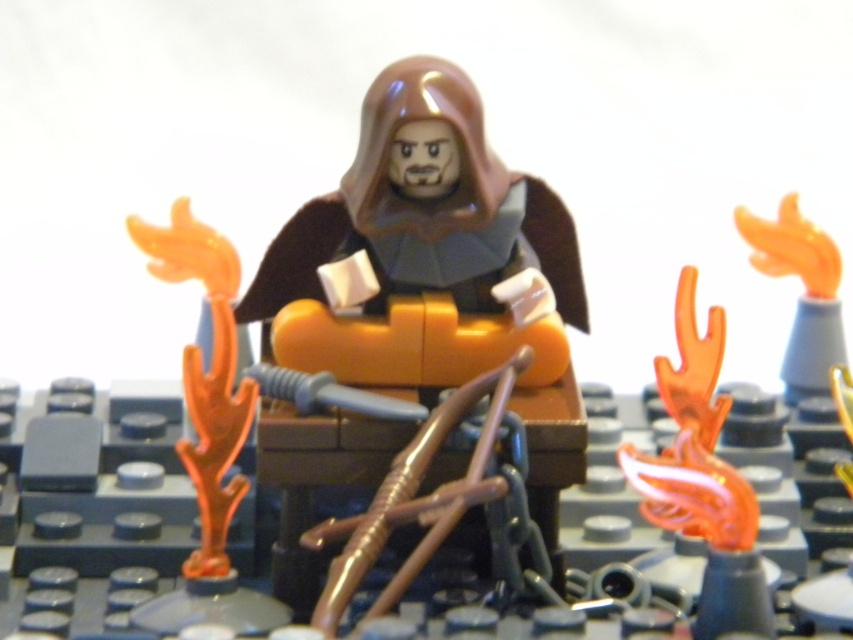
You are standing at the base of the throne and want to place a small LEGO brick. You have two points marked as point 1 at coordinates point [527,257] and point 2 at coordinates point [827,280]. Which point is closer to the front of the throne?

Point [527,257] is in front of point [827,280], so point 1 is closer to the front of the throne.